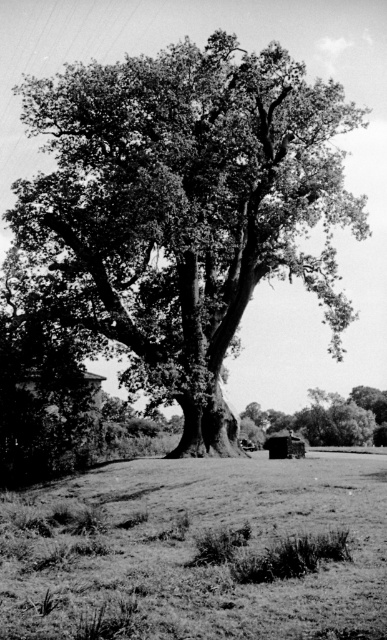
You are standing at the center of the image and want to locate the dark green leafy oak tree at center. Which direction should you look to find it?

The dark green leafy oak tree at center is located at point coordinates of (184, 208), so you should look directly ahead since it is at the center of the image.

You are standing in front of the large tree in the image and notice two points marked on the ground. The first point is at coordinate point [356,228] and the second is at point [373,460]. Which point is closer to you?

Point [356,228] is closer to you because it is further to the viewer than point [373,460].